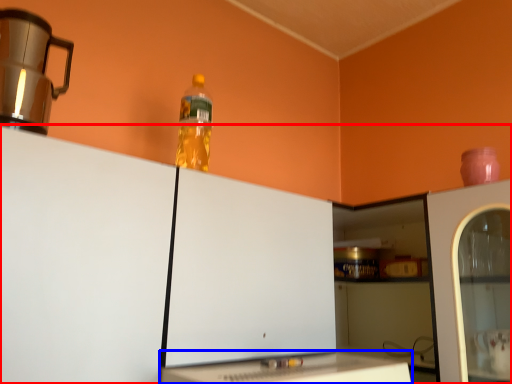
Question: Which object is closer to the camera taking this photo, cabinetry (highlighted by a red box) or table (highlighted by a blue box)?

Choices:
 (A) cabinetry
 (B) table

Answer: (A)